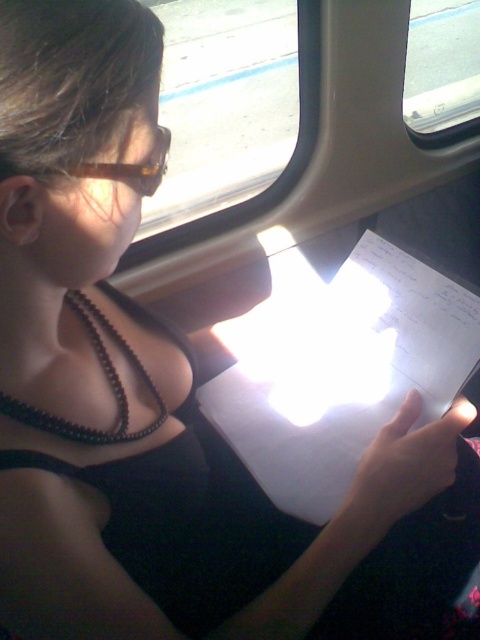
Question: Which point is farther to the camera?

Choices:
 (A) (135, 184)
 (B) (368, 244)

Answer: (B)

Question: Does transparent glass train window at upper center appear on the left side of black beaded necklace at center?

Choices:
 (A) yes
 (B) no

Answer: (B)

Question: Can you confirm if black beaded necklace at center is smaller than brown translucent goggles at upper left?

Choices:
 (A) no
 (B) yes

Answer: (A)

Question: Among these objects, which one is farthest from the camera?

Choices:
 (A) brown translucent goggles at upper left
 (B) black beaded necklace at center
 (C) white paper at center

Answer: (C)

Question: Which of the following is the closest to the observer?

Choices:
 (A) black beaded necklace at center
 (B) brown translucent goggles at upper left
 (C) white paper at center

Answer: (B)

Question: Is white paper at center to the left of brown translucent goggles at upper left from the viewer's perspective?

Choices:
 (A) yes
 (B) no

Answer: (B)